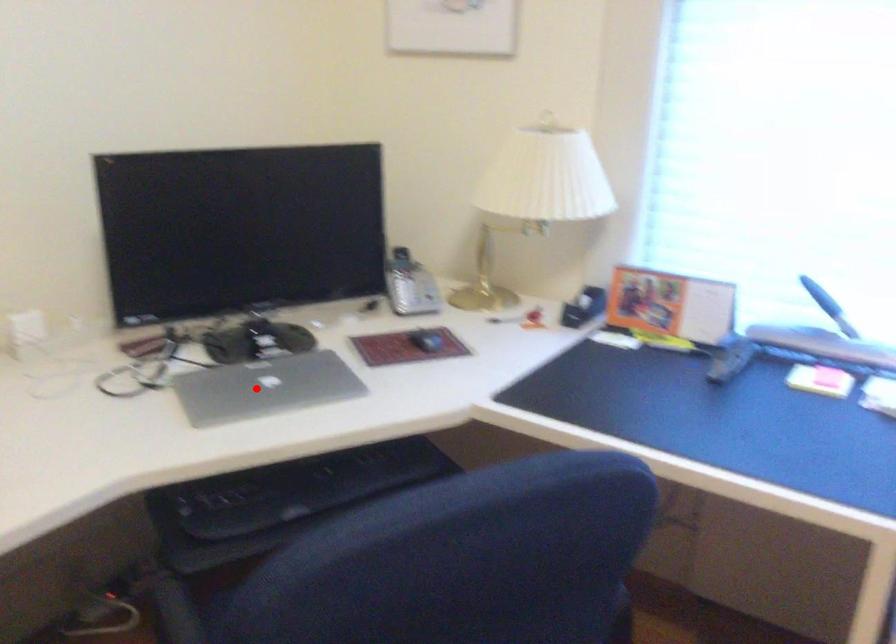
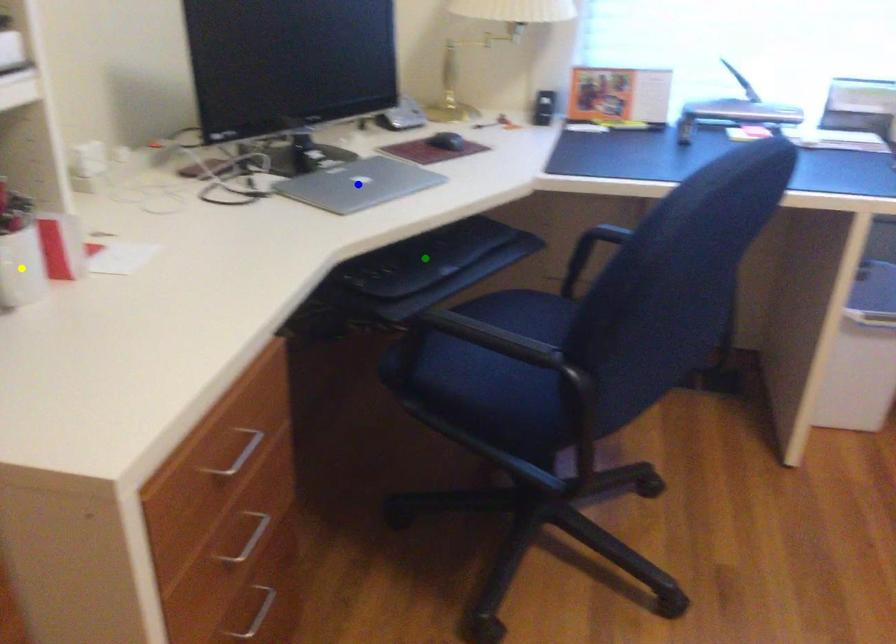
Question: I am providing you with two images of the same scene from different viewpoints. A red point is marked on the first image. You are given multiple points on the second image. In image 2, which mark is for the same physical point as the one in image 1?

Choices:
 (A) green point
 (B) blue point
 (C) yellow point

Answer: (B)